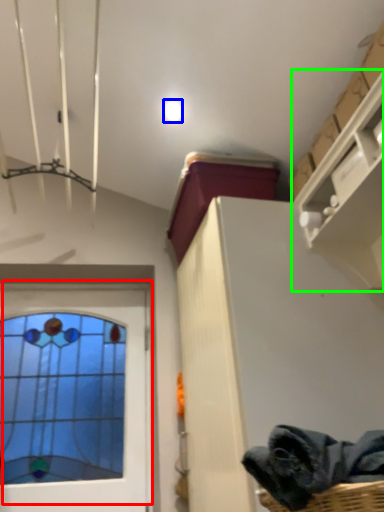
Question: Considering the real-world distances, which object is farthest from window (highlighted by a red box)? droplight (highlighted by a blue box) or shelf (highlighted by a green box)?

Choices:
 (A) droplight
 (B) shelf

Answer: (A)